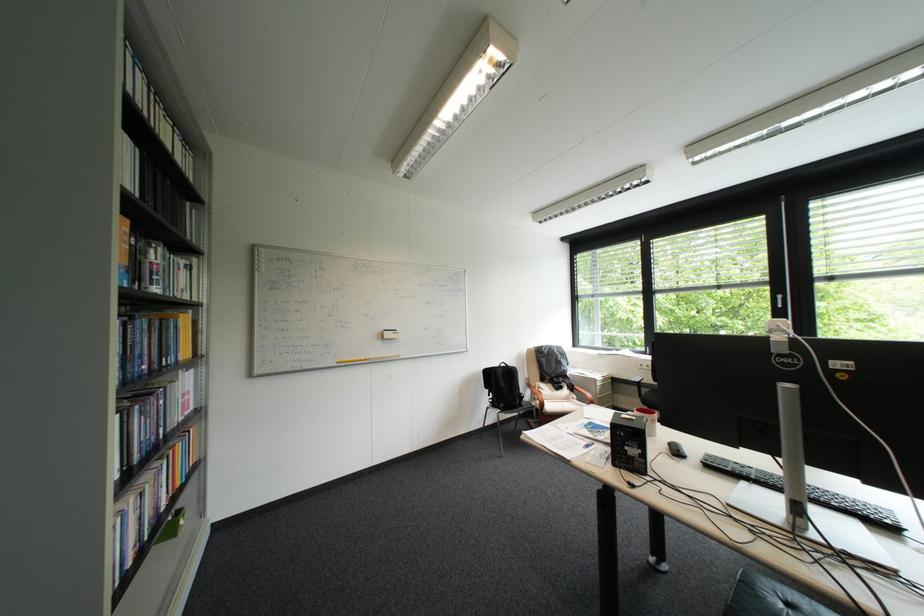
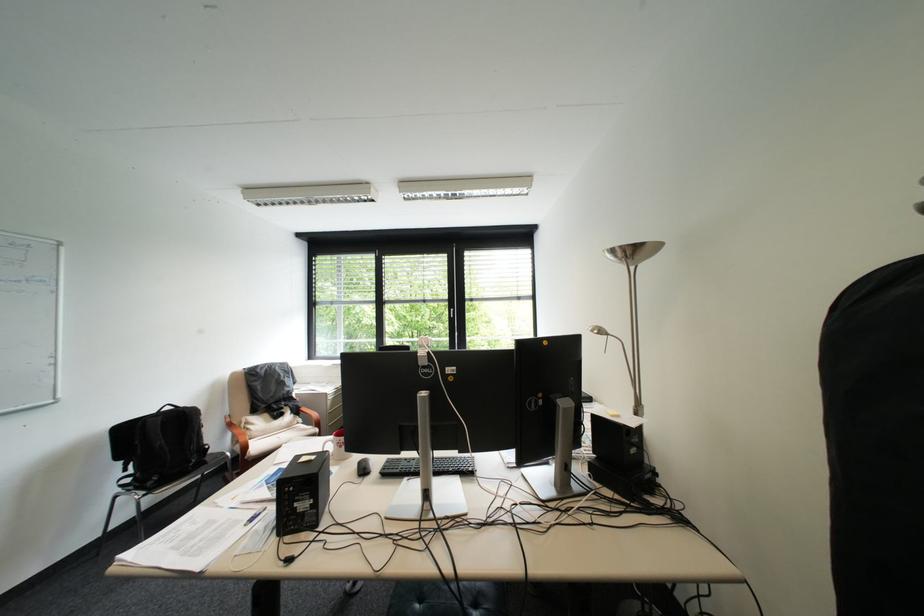
Where in the second image is the point corresponding to (x=541, y=392) from the first image?

(241, 434)